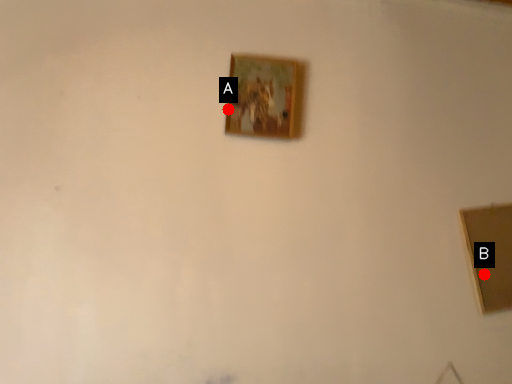
Question: Two points are circled on the image, labeled by A and B beside each circle. Which point appears closest to the camera in this image?

Choices:
 (A) A is closer
 (B) B is closer

Answer: (A)